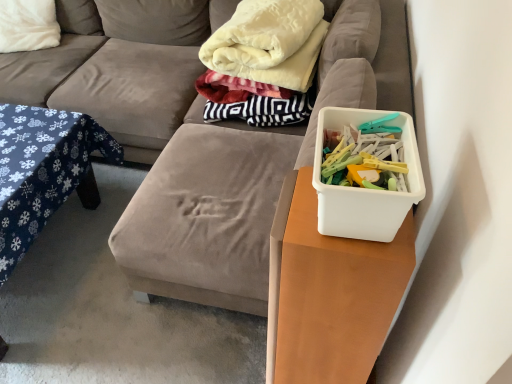
Question: Are white plastic container at right and white soft pillow at upper left located far from each other?

Choices:
 (A) yes
 (B) no

Answer: (A)

Question: Does white plastic container at right have a greater height compared to white soft pillow at upper left?

Choices:
 (A) yes
 (B) no

Answer: (B)

Question: Can you confirm if white plastic container at right is positioned to the right of white soft pillow at upper left?

Choices:
 (A) yes
 (B) no

Answer: (A)

Question: Can you confirm if white plastic container at right is positioned to the left of white soft pillow at upper left?

Choices:
 (A) no
 (B) yes

Answer: (A)

Question: Can we say white plastic container at right lies outside white soft pillow at upper left?

Choices:
 (A) no
 (B) yes

Answer: (B)

Question: Considering their positions, is white plastic container at right located in front of or behind velvety white blanket at upper center?

Choices:
 (A) behind
 (B) front

Answer: (B)

Question: Is white plastic container at right spatially inside velvety white blanket at upper center, or outside of it?

Choices:
 (A) inside
 (B) outside

Answer: (B)

Question: From the image's perspective, is white plastic container at right above or below velvety white blanket at upper center?

Choices:
 (A) below
 (B) above

Answer: (A)

Question: Considering the positions of point (328, 190) and point (276, 19), is point (328, 190) closer or farther from the camera than point (276, 19)?

Choices:
 (A) closer
 (B) farther

Answer: (A)

Question: From a real-world perspective, relative to blue fabric table at left, is velvet fabric couch at center vertically above or below?

Choices:
 (A) below
 (B) above

Answer: (B)

Question: Is velvet fabric couch at center wider or thinner than blue fabric table at left?

Choices:
 (A) wide
 (B) thin

Answer: (A)

Question: Is velvet fabric couch at center taller or shorter than blue fabric table at left?

Choices:
 (A) short
 (B) tall

Answer: (B)

Question: In terms of size, does velvet fabric couch at center appear bigger or smaller than blue fabric table at left?

Choices:
 (A) small
 (B) big

Answer: (B)

Question: From the image's perspective, is velvety white blanket at upper center located above or below velvet fabric couch at center?

Choices:
 (A) above
 (B) below

Answer: (A)

Question: Looking at their shapes, would you say velvety white blanket at upper center is wider or thinner than velvet fabric couch at center?

Choices:
 (A) wide
 (B) thin

Answer: (B)